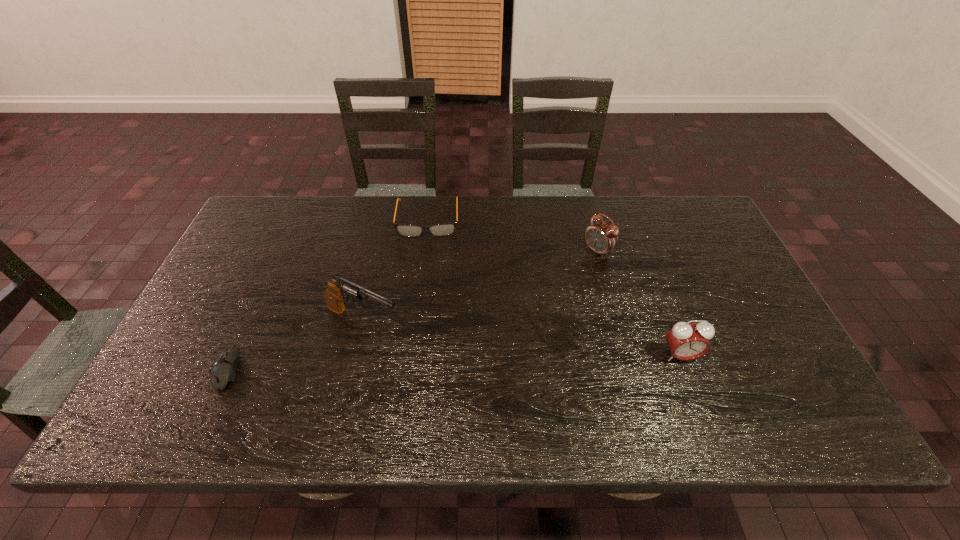
Find the location of `free space on the desktop that is between the computer mouse and the right alarm clock and is positioned along the barrel of the third nearest object`. free space on the desktop that is between the computer mouse and the right alarm clock and is positioned along the barrel of the third nearest object is located at coordinates (444, 362).

You are a GUI agent. You are given a task and a screenshot of the screen. Output one action in this format:
    pyautogui.click(x=<x>, y=<y>)
    Task: Click on the free space on the desktop that is between the computer mouse and the nearer alarm clock and is positioned on the front-facing side of the spectacles
    
    Given the screenshot: What is the action you would take?
    pyautogui.click(x=419, y=362)

Locate an element on the screen. The width and height of the screenshot is (960, 540). vacant space on the desktop that is between the shortest object and the nearer alarm clock and is positioned on the face of the farther alarm clock is located at coordinates (434, 362).